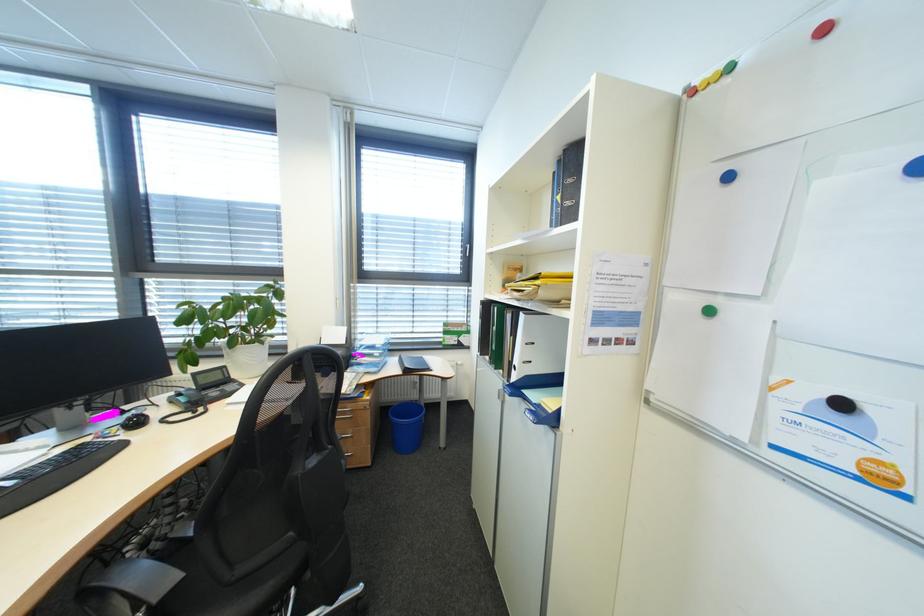
I want to click on phone handset, so click(x=176, y=399).